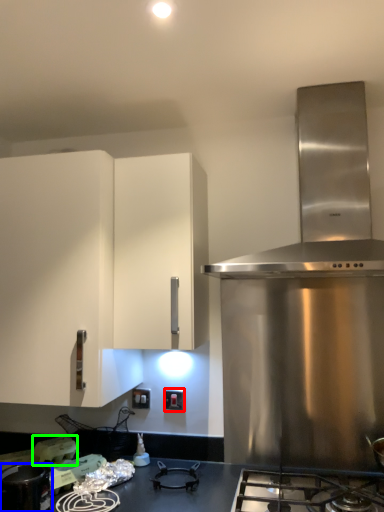
Question: Which is farther away from electric outlet (highlighted by a red box)? kitchen appliance (highlighted by a blue box) or appliance (highlighted by a green box)?

Choices:
 (A) kitchen appliance
 (B) appliance

Answer: (A)